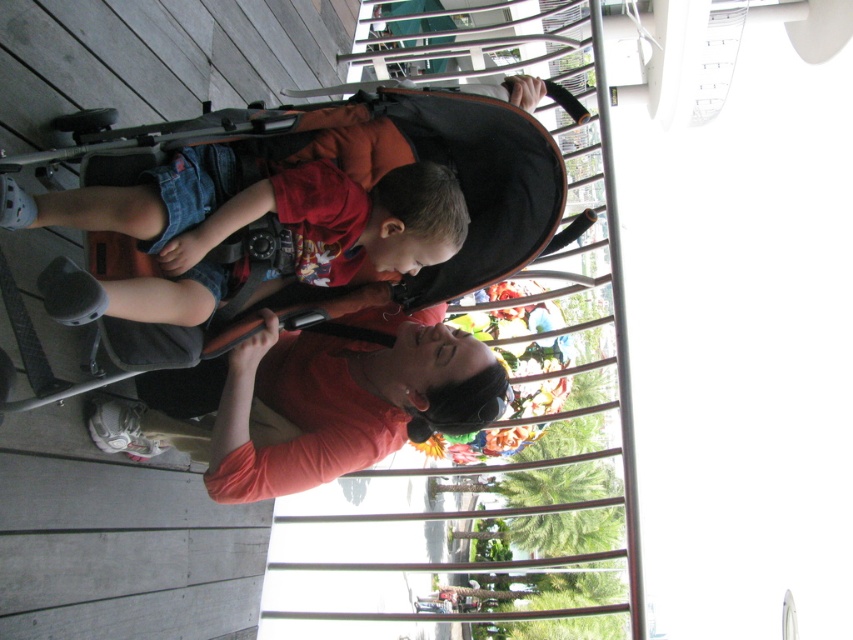
Is orange matte shirt at center further to the viewer compared to denim shorts at center?

Yes, it is.

I want to click on orange matte shirt at center, so click(312, 403).

Which is more to the left, black fabric stroller at center or orange matte shirt at center?

From the viewer's perspective, orange matte shirt at center appears more on the left side.

Is point (373, 140) positioned after point (479, 364)?

That is False.

Which is in front, point (245, 209) or point (215, 376)?

Point (245, 209) is more forward.

At what (x,y) coordinates should I click in order to perform the action: click on black fabric stroller at center. Please return your answer as a coordinate pair (x, y). The image size is (853, 640). Looking at the image, I should click on (306, 209).

Can you confirm if black fabric stroller at center is taller than denim shorts at center?

Yes.

Between black fabric stroller at center and denim shorts at center, which one appears on the right side from the viewer's perspective?

From the viewer's perspective, black fabric stroller at center appears more on the right side.

Where is `black fabric stroller at center`? Image resolution: width=853 pixels, height=640 pixels. black fabric stroller at center is located at coordinates [306, 209].

Where is `black fabric stroller at center`? black fabric stroller at center is located at coordinates (306, 209).